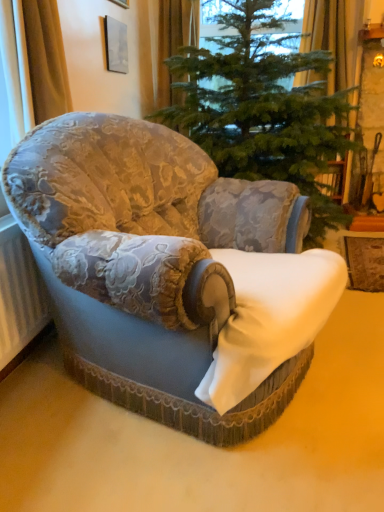
Question: Considering their positions, is white textured radiator at lower left located in front of or behind green textured christmas tree at center?

Choices:
 (A) behind
 (B) front

Answer: (B)

Question: Is white textured radiator at lower left to the left or to the right of green textured christmas tree at center in the image?

Choices:
 (A) right
 (B) left

Answer: (B)

Question: Considering the real-world distances, which object is closest to the yellow fabric curtain at upper right, the 3th curtain from the left?

Choices:
 (A) gold textured curtain at left, which is counted as the third curtain, starting from the right
 (B) velvet floral armchair at center
 (C) white textured radiator at lower left
 (D) green textured christmas tree at center
 (E) orange fabric curtain at upper center, placed as the 3th curtain when sorted from front to back

Answer: (D)

Question: Which of these objects is positioned closest to the green textured christmas tree at center?

Choices:
 (A) gold textured curtain at left, which is counted as the third curtain, starting from the right
 (B) white textured radiator at lower left
 (C) velvet floral armchair at center
 (D) orange fabric curtain at upper center, the second curtain from the right
 (E) yellow fabric curtain at upper right, arranged as the 2th curtain when viewed from the back

Answer: (E)